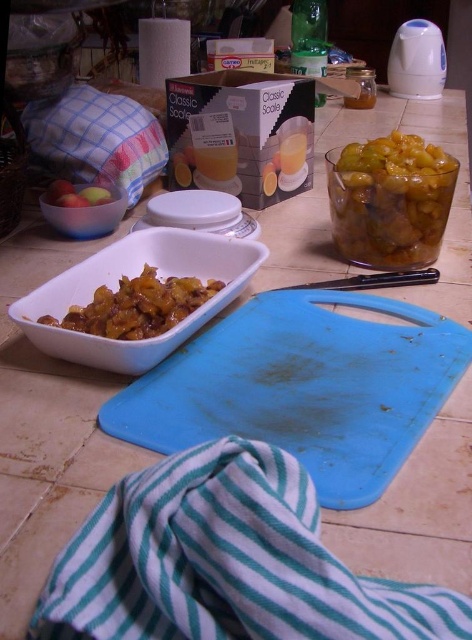
Which is in front, point (227, 276) or point (93, 298)?

Point (93, 298)

Describe the element at coordinates (131, 276) in the screenshot. I see `white glossy bowl at center-left` at that location.

Identify the location of white glossy bowl at center-left. The image size is (472, 640). (131, 276).

Can you confirm if translucent plastic juice at center is shorter than translucent plastic cup at center?

Yes, translucent plastic juice at center is shorter than translucent plastic cup at center.

Who is shorter, translucent plastic juice at center or translucent plastic cup at center?

translucent plastic juice at center

Identify the location of translucent plastic juice at center. (216, 161).

Can you confirm if translucent plastic juice at center is wider than smooth glossy apple at center left?

In fact, translucent plastic juice at center might be narrower than smooth glossy apple at center left.

Is translucent plastic juice at center taller than smooth glossy apple at center left?

No, translucent plastic juice at center is not taller than smooth glossy apple at center left.

Which is behind, point (211, 164) or point (104, 200)?

Point (211, 164)

At what (x,y) coordinates should I click in order to perform the action: click on translucent plastic juice at center. Please return your answer as a coordinate pair (x, y). The width and height of the screenshot is (472, 640). Looking at the image, I should click on (216, 161).